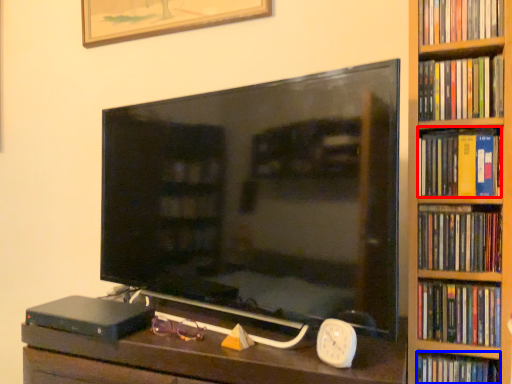
Question: Which point is closer to the camera, book (highlighted by a red box) or book (highlighted by a blue box)?

Choices:
 (A) book
 (B) book

Answer: (A)